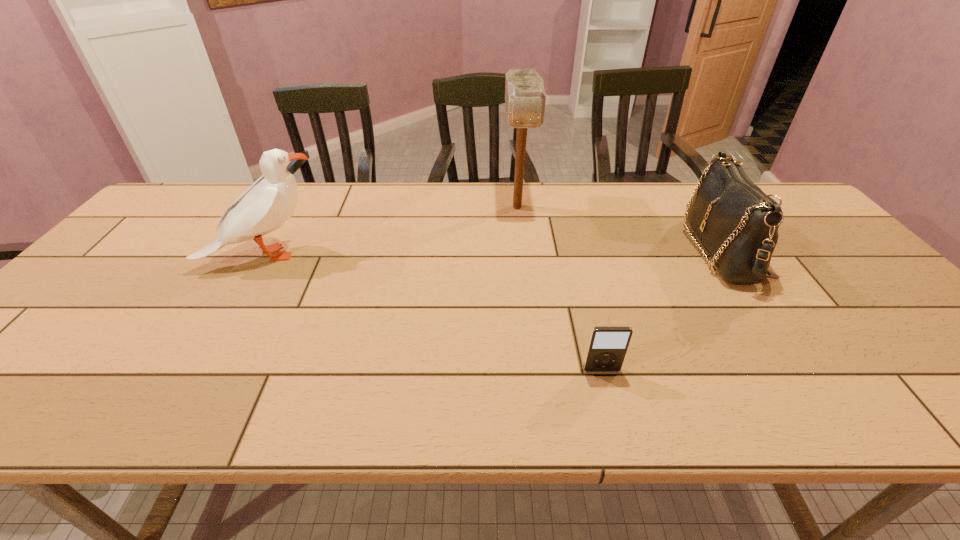
The height and width of the screenshot is (540, 960). In order to click on the second object from left to right in this screenshot , I will do `click(525, 99)`.

Locate an element on the screen. The image size is (960, 540). mallet is located at coordinates (525, 99).

Where is `the leftmost object`? The width and height of the screenshot is (960, 540). the leftmost object is located at coordinates (270, 201).

Identify the location of gull. This screenshot has height=540, width=960. (270, 201).

What are the coordinates of `handbag` in the screenshot? It's located at (737, 223).

You are a GUI agent. You are given a task and a screenshot of the screen. Output one action in this format:
    pyautogui.click(x=<x>, y=<y>)
    Task: Click on the rightmost object
    Image resolution: width=960 pixels, height=540 pixels.
    Given the screenshot: What is the action you would take?
    pyautogui.click(x=737, y=223)

Where is `iPod`? Image resolution: width=960 pixels, height=540 pixels. iPod is located at coordinates click(607, 347).

Identify the location of the third object from left to right. The image size is (960, 540). (607, 347).

Image resolution: width=960 pixels, height=540 pixels. Identify the location of vacant space situated on the striking face of the mallet. (525, 277).

Locate an element on the screen. The width and height of the screenshot is (960, 540). free point located 0.340m at the beak of the third shortest object is located at coordinates (445, 255).